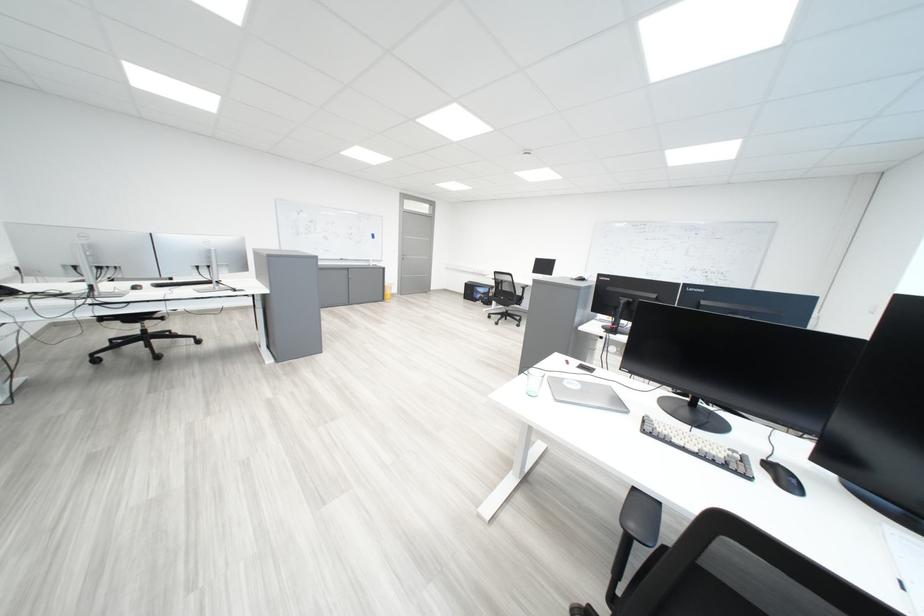
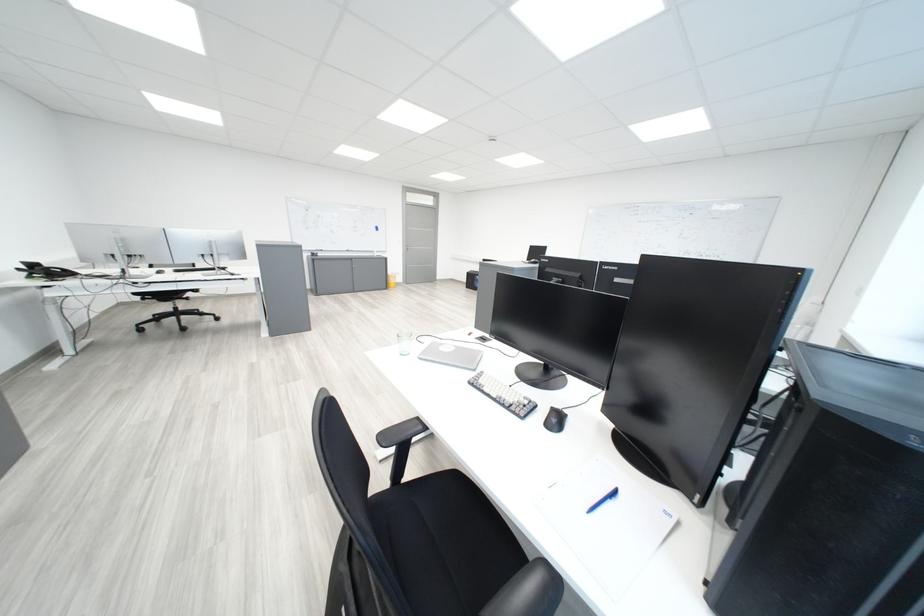
Question: The camera is either moving clockwise (left) or counter-clockwise (right) around the object. The first image is from the beginning of the video and the second image is from the end. Is the camera moving left or right when shooting the video?

Choices:
 (A) Left
 (B) Right

Answer: (B)